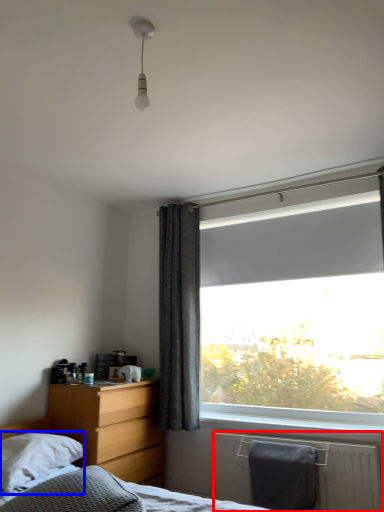
Question: Which object is closer to the camera taking this photo, radiator (highlighted by a red box) or pillow (highlighted by a blue box)?

Choices:
 (A) radiator
 (B) pillow

Answer: (B)